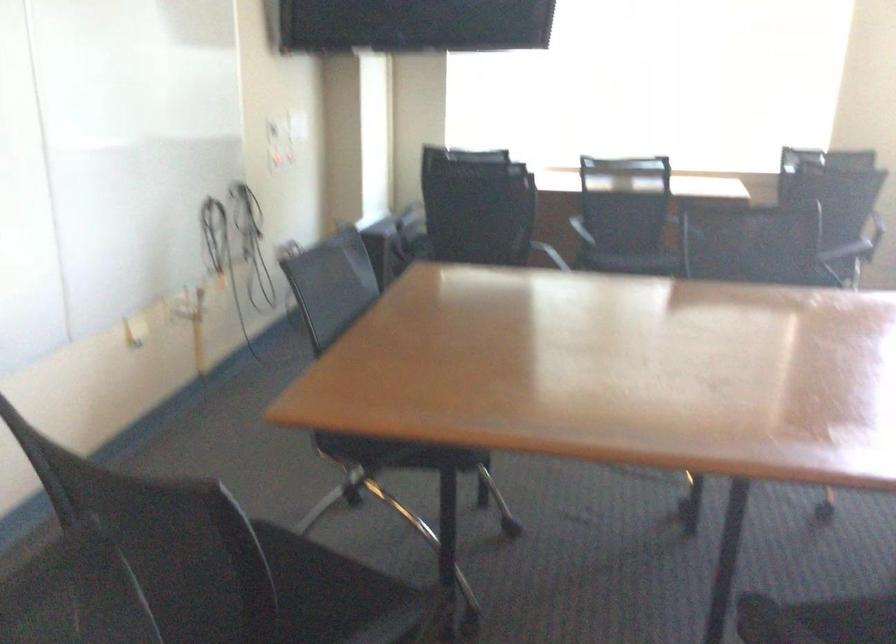
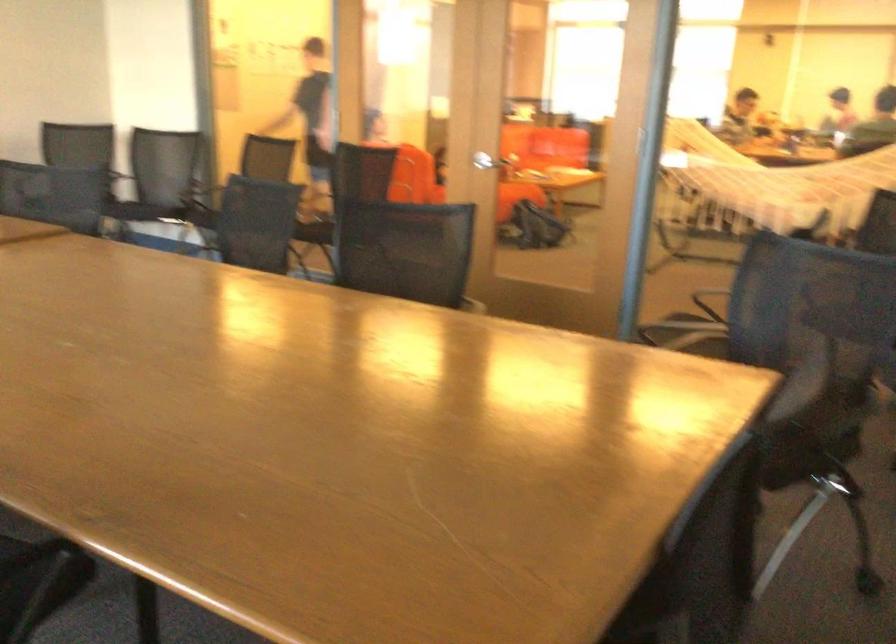
Question: I am providing you with two images of the same scene from different viewpoints. Which of the following objects are not visible in image2?

Choices:
 (A) teal blue pillow
 (B) chair sitting surface
 (C) black backpack
 (D) silver door handle

Answer: (B)